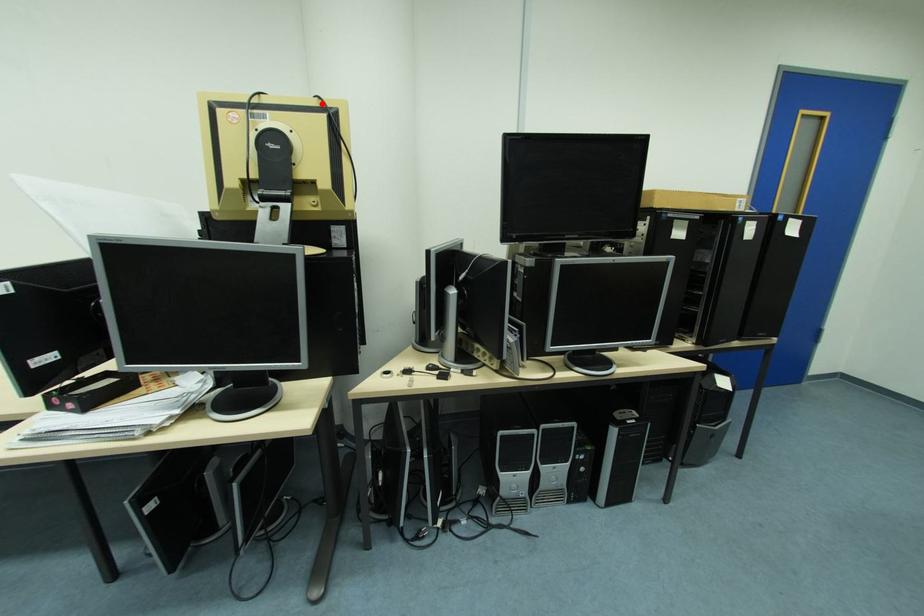
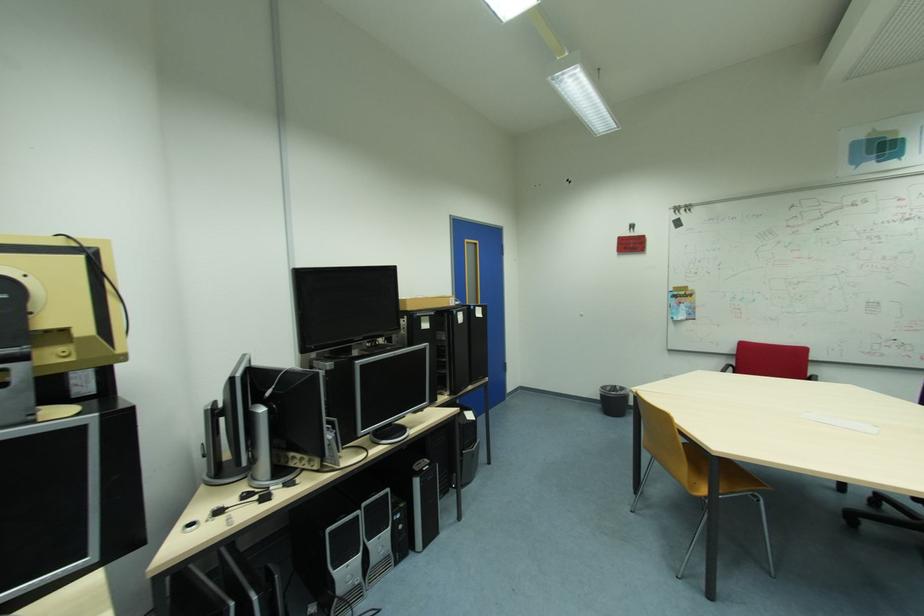
The point at the highlighted location is marked in the first image. Where is the corresponding point in the second image?

(66, 244)